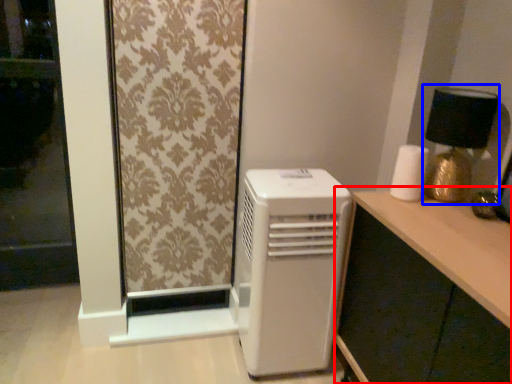
Question: Which object appears closest to the camera in this image, computer desk (highlighted by a red box) or table lamp (highlighted by a blue box)?

Choices:
 (A) computer desk
 (B) table lamp

Answer: (A)